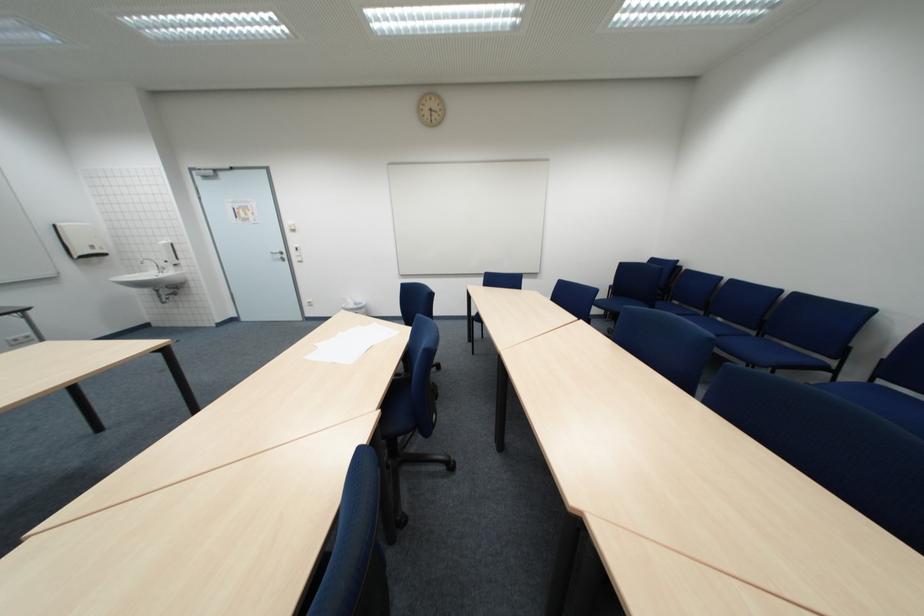
Find the location of a particular element. The height and width of the screenshot is (616, 924). wall-mounted soap dispenser is located at coordinates (168, 252).